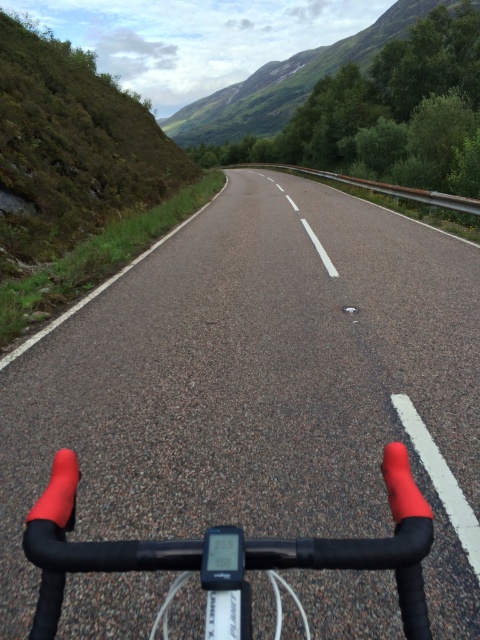
You are a cyclist riding along the road and see two points marked on the road ahead. The first point is at coordinates point (334, 193). The second point is at coordinates point 0.505, 0.495. According to the scene description, which point is closer to you?

The point at coordinates point (334, 193) is closer to you because in the scene description, it is mentioned that the road curves gently to the right, and the first point is positioned at lower center, which is closer to the cyclist compared to the second point at lower right which is further away.

You are a cyclist navigating a rural road. You notice two points marked on your path ahead. The first is at point (355, 440), and the second is at point (394, 563). As you move forward, which point will you reach first?

You will reach point (355, 440) first because it is closer to you than point (394, 563), which is further ahead on the road.

Consider the image. You are riding a bicycle and want to check the distance between the asphalt road at center and the rubberized matte handlebars at center. Which one is closer to you?

The rubberized matte handlebars at center are closer to you than the asphalt road at center.